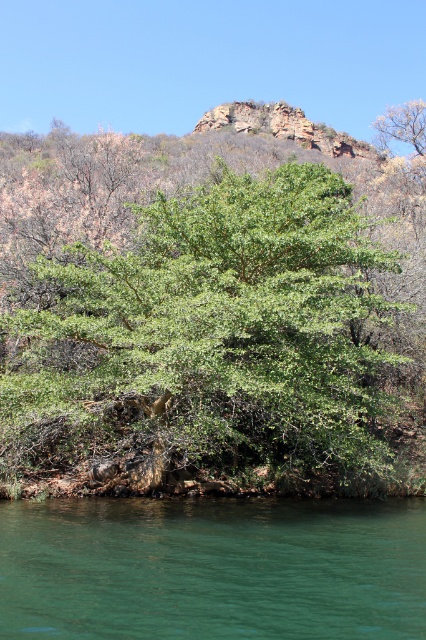
Question: Among these objects, which one is nearest to the camera?

Choices:
 (A) green smooth water at lower center
 (B) green leafy tree at center

Answer: (A)

Question: Can you confirm if green leafy tree at center is positioned to the right of green smooth water at lower center?

Choices:
 (A) no
 (B) yes

Answer: (B)

Question: Does green leafy tree at center have a smaller size compared to green smooth water at lower center?

Choices:
 (A) no
 (B) yes

Answer: (A)

Question: In this image, where is green leafy tree at center located relative to green smooth water at lower center?

Choices:
 (A) left
 (B) right

Answer: (B)

Question: Which object is farther from the camera taking this photo?

Choices:
 (A) green leafy tree at center
 (B) green smooth water at lower center

Answer: (A)